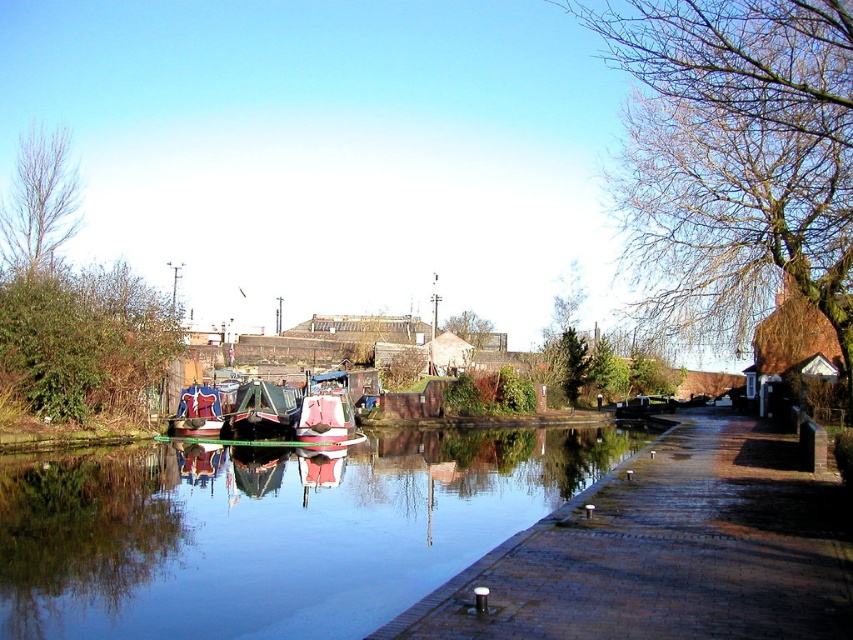
Is bare branches at upper right in front of wooden polished boat at center?

That is True.

Is point (721, 58) farther from camera compared to point (273, 392)?

No, (721, 58) is closer to viewer.

Where is `bare branches at upper right`? Image resolution: width=853 pixels, height=640 pixels. bare branches at upper right is located at coordinates (740, 148).

Does bare branches at upper right have a lesser width compared to green leafy tree at left?

In fact, bare branches at upper right might be wider than green leafy tree at left.

Is bare branches at upper right wider than green leafy tree at left?

Yes.

Describe the element at coordinates (740, 148) in the screenshot. I see `bare branches at upper right` at that location.

Where is `bare branches at upper right`? This screenshot has height=640, width=853. bare branches at upper right is located at coordinates (740, 148).

Is bare branches at upper left wider than wooden polished boat at center?

Indeed, bare branches at upper left has a greater width compared to wooden polished boat at center.

Does point (21, 182) lie in front of point (256, 417)?

No.

At what (x,y) coordinates should I click in order to perform the action: click on bare branches at upper left. Please return your answer as a coordinate pair (x, y). The image size is (853, 640). Looking at the image, I should click on click(x=39, y=204).